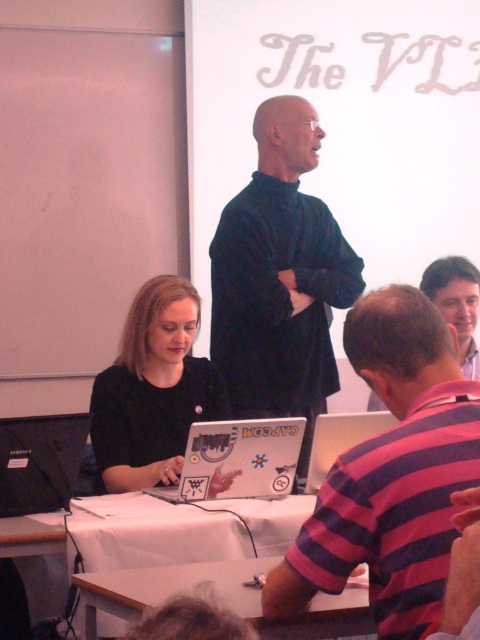
Is point (183, 588) positioned after point (213, 477)?

No, it is in front of (213, 477).

Is point (96, 600) less distant than point (262, 460)?

Yes.

The height and width of the screenshot is (640, 480). Find the location of `wooden table at lower center`. wooden table at lower center is located at coordinates tap(219, 596).

Between black matte sweater at center and matte black laptop at lower left, which one appears on the left side from the viewer's perspective?

From the viewer's perspective, matte black laptop at lower left appears more on the left side.

In the scene shown: Is black matte sweater at center shorter than matte black laptop at lower left?

Incorrect, black matte sweater at center's height does not fall short of matte black laptop at lower left's.

Find the location of a particular element. Image resolution: width=480 pixels, height=640 pixels. black matte sweater at center is located at coordinates (279, 278).

Is white cloth-covered table at center closer to camera compared to white matte laptop at lower center?

Yes.

Is point (115, 529) less distant than point (212, 497)?

Yes, it is.

You are a GUI agent. You are given a task and a screenshot of the screen. Output one action in this format:
    pyautogui.click(x=<x>, y=<y>)
    Task: Click on the white cloth-covered table at center
    
    Given the screenshot: What is the action you would take?
    pyautogui.click(x=154, y=532)